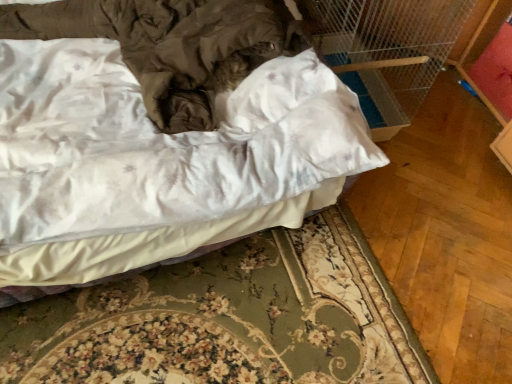
Identify the location of satin white bed at center. The width and height of the screenshot is (512, 384). (161, 136).

Measure the distance between satin white bed at center and camera.

satin white bed at center and camera are 36.29 inches apart.

What do you see at coordinates (161, 136) in the screenshot?
I see `satin white bed at center` at bounding box center [161, 136].

The height and width of the screenshot is (384, 512). What do you see at coordinates (227, 319) in the screenshot?
I see `white fabric bed frame at lower center` at bounding box center [227, 319].

This screenshot has height=384, width=512. In order to click on white fabric bed frame at lower center in this screenshot , I will do `click(227, 319)`.

Where is `satin white bed at center`? satin white bed at center is located at coordinates (161, 136).

Does white fabric bed frame at lower center appear on the left side of satin white bed at center?

No.

Considering their positions, is white fabric bed frame at lower center located in front of or behind satin white bed at center?

In the image, white fabric bed frame at lower center appears behind satin white bed at center.

Which is nearer, [374,347] or [161,156]?

Point [374,347].

From the image's perspective, between white fabric bed frame at lower center and satin white bed at center, which one is located above?

satin white bed at center appears higher in the image.

From a real-world perspective, which is physically below, white fabric bed frame at lower center or satin white bed at center?

white fabric bed frame at lower center.

Is white fabric bed frame at lower center thinner than satin white bed at center?

Indeed, white fabric bed frame at lower center has a lesser width compared to satin white bed at center.

Considering the relative sizes of white fabric bed frame at lower center and satin white bed at center in the image provided, is white fabric bed frame at lower center taller than satin white bed at center?

No.

Between white fabric bed frame at lower center and satin white bed at center, which one has smaller size?

With smaller size is white fabric bed frame at lower center.

Would you say satin white bed at center is part of white fabric bed frame at lower center's contents?

No, satin white bed at center is not inside white fabric bed frame at lower center.

Is white fabric bed frame at lower center far away from satin white bed at center?

No, white fabric bed frame at lower center is not far from satin white bed at center.

In the scene shown: Is white fabric bed frame at lower center facing away from satin white bed at center?

No, white fabric bed frame at lower center is not facing the opposite direction of satin white bed at center.

I want to click on bed above the white fabric bed frame at lower center (from a real-world perspective), so click(161, 136).

Is satin white bed at center to the right of white fabric bed frame at lower center from the viewer's perspective?

In fact, satin white bed at center is to the left of white fabric bed frame at lower center.

Relative to white fabric bed frame at lower center, is satin white bed at center in front or behind?

Clearly, satin white bed at center is in front of white fabric bed frame at lower center.

Which is in front, point (132, 265) or point (380, 379)?

The point (132, 265) is more forward.

From the image's perspective, is satin white bed at center located above or below white fabric bed frame at lower center?

Clearly, from the image's perspective, satin white bed at center is above white fabric bed frame at lower center.

From a real-world perspective, who is located lower, satin white bed at center or white fabric bed frame at lower center?

white fabric bed frame at lower center, from a real-world perspective.

In terms of width, does satin white bed at center look wider or thinner when compared to white fabric bed frame at lower center?

Clearly, satin white bed at center has more width compared to white fabric bed frame at lower center.

Considering the relative sizes of satin white bed at center and white fabric bed frame at lower center in the image provided, is satin white bed at center shorter than white fabric bed frame at lower center?

No, satin white bed at center is not shorter than white fabric bed frame at lower center.

Between satin white bed at center and white fabric bed frame at lower center, which one has smaller size?

Smaller between the two is white fabric bed frame at lower center.

Could white fabric bed frame at lower center be considered to be inside satin white bed at center?

Definitely not — white fabric bed frame at lower center is not inside satin white bed at center.

Does satin white bed at center touch white fabric bed frame at lower center?

No.

Is satin white bed at center turned away from white fabric bed frame at lower center?

No, satin white bed at center is not facing the opposite direction of white fabric bed frame at lower center.

What's the angular difference between satin white bed at center and white fabric bed frame at lower center's facing directions?

satin white bed at center and white fabric bed frame at lower center are facing 89.9 degrees away from each other.

The height and width of the screenshot is (384, 512). What are the coordinates of `bed frame below the satin white bed at center (from a real-world perspective)` in the screenshot? It's located at (227, 319).

Identify the location of bed located above the white fabric bed frame at lower center (from a real-world perspective). (161, 136).

I want to click on bed frame located on the right of satin white bed at center, so click(x=227, y=319).